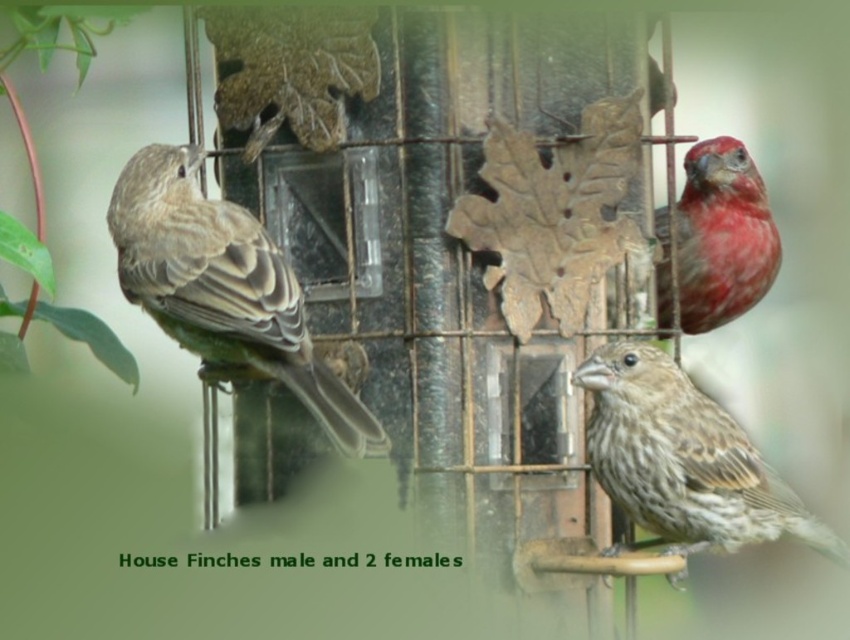
Who is lower down, brown speckled sparrow at left or brown speckled sparrow at lower right?

brown speckled sparrow at lower right is lower down.

Does point (197, 301) come behind point (599, 419)?

No, it is in front of (599, 419).

This screenshot has height=640, width=850. I want to click on brown speckled sparrow at left, so click(224, 288).

Is brown speckled sparrow at left wider than matte red finch at upper right?

Correct, the width of brown speckled sparrow at left exceeds that of matte red finch at upper right.

Who is higher up, brown speckled sparrow at left or matte red finch at upper right?

Positioned higher is matte red finch at upper right.

Where is `brown speckled sparrow at left`? Image resolution: width=850 pixels, height=640 pixels. brown speckled sparrow at left is located at coordinates (224, 288).

Which is in front, point (663, 483) or point (768, 241)?

Positioned in front is point (663, 483).

Can you confirm if brown speckled sparrow at lower right is positioned below matte red finch at upper right?

Correct, brown speckled sparrow at lower right is located below matte red finch at upper right.

Who is more distant from viewer, (701, 500) or (688, 209)?

The point (688, 209) is more distant.

This screenshot has width=850, height=640. I want to click on brown speckled sparrow at lower right, so click(x=683, y=460).